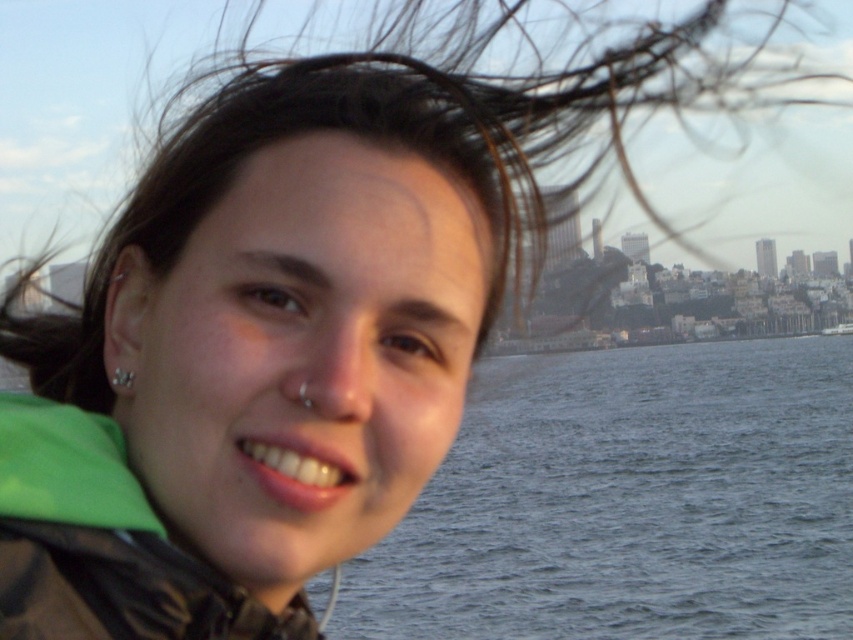
How much distance is there between blue water at center and green fabric jacket at lower left?

The distance of blue water at center from green fabric jacket at lower left is 435.22 feet.

Is blue water at center shorter than green fabric jacket at lower left?

No, blue water at center is not shorter than green fabric jacket at lower left.

Find the location of `blue water at center`. blue water at center is located at coordinates (630, 502).

Identify the location of blue water at center. The height and width of the screenshot is (640, 853). (630, 502).